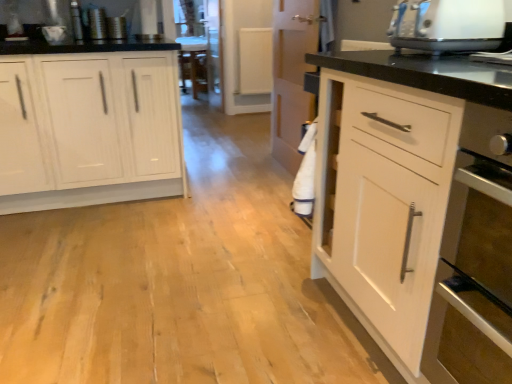
Question: Should I look upward or downward to see white plastic toaster at upper right?

Choices:
 (A) up
 (B) down

Answer: (A)

Question: Considering the relative positions of white plastic toaster at upper right and white wood cabinet at left in the image provided, is white plastic toaster at upper right in front of white wood cabinet at left?

Choices:
 (A) no
 (B) yes

Answer: (B)

Question: Considering the relative sizes of white plastic toaster at upper right and white wood cabinet at left in the image provided, is white plastic toaster at upper right wider than white wood cabinet at left?

Choices:
 (A) yes
 (B) no

Answer: (B)

Question: Could you tell me if white plastic toaster at upper right is turned towards white wood cabinet at left?

Choices:
 (A) yes
 (B) no

Answer: (B)

Question: Does white plastic toaster at upper right appear on the left side of white wood cabinet at left?

Choices:
 (A) no
 (B) yes

Answer: (A)

Question: Is white plastic toaster at upper right directly adjacent to white wood cabinet at left?

Choices:
 (A) no
 (B) yes

Answer: (A)

Question: Does white plastic toaster at upper right have a smaller size compared to white wood cabinet at left?

Choices:
 (A) no
 (B) yes

Answer: (B)

Question: Considering the relative sizes of white wood cabinet at left and white plastic toaster at upper right in the image provided, is white wood cabinet at left shorter than white plastic toaster at upper right?

Choices:
 (A) yes
 (B) no

Answer: (B)

Question: Would you say white plastic toaster at upper right is part of white wood cabinet at left's contents?

Choices:
 (A) no
 (B) yes

Answer: (A)

Question: Can you confirm if white wood cabinet at left is smaller than white plastic toaster at upper right?

Choices:
 (A) no
 (B) yes

Answer: (A)

Question: Is white wood cabinet at left bigger than white plastic toaster at upper right?

Choices:
 (A) yes
 (B) no

Answer: (A)

Question: From the image's perspective, is white wood cabinet at left above white plastic toaster at upper right?

Choices:
 (A) yes
 (B) no

Answer: (B)

Question: From the image's perspective, is white wood cabinet at left under white plastic toaster at upper right?

Choices:
 (A) yes
 (B) no

Answer: (A)

Question: Based on their sizes in the image, would you say white wood cabinet at left is bigger or smaller than white plastic toaster at upper right?

Choices:
 (A) big
 (B) small

Answer: (A)